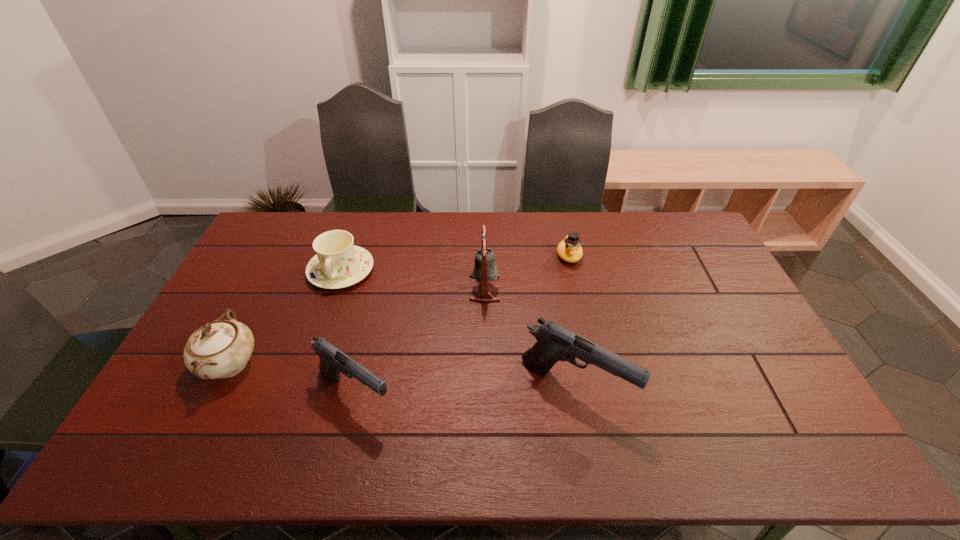
Please point a spot on the right to add another gun. Please provide its 2D coordinates. Your answer should be formatted as a tuple, i.e. [(x, y)], where the tuple contains the x and y coordinates of a point satisfying the conditions above.

[(788, 383)]